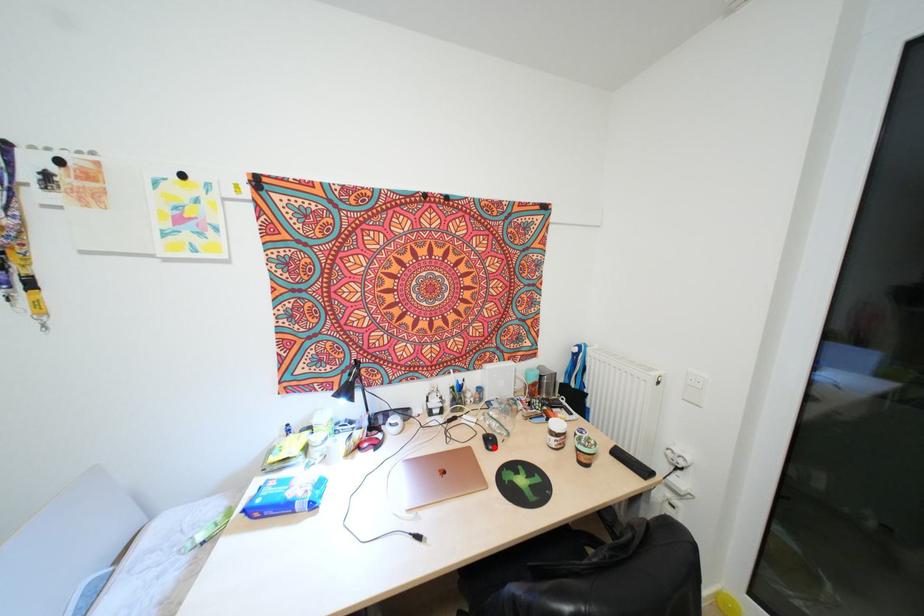
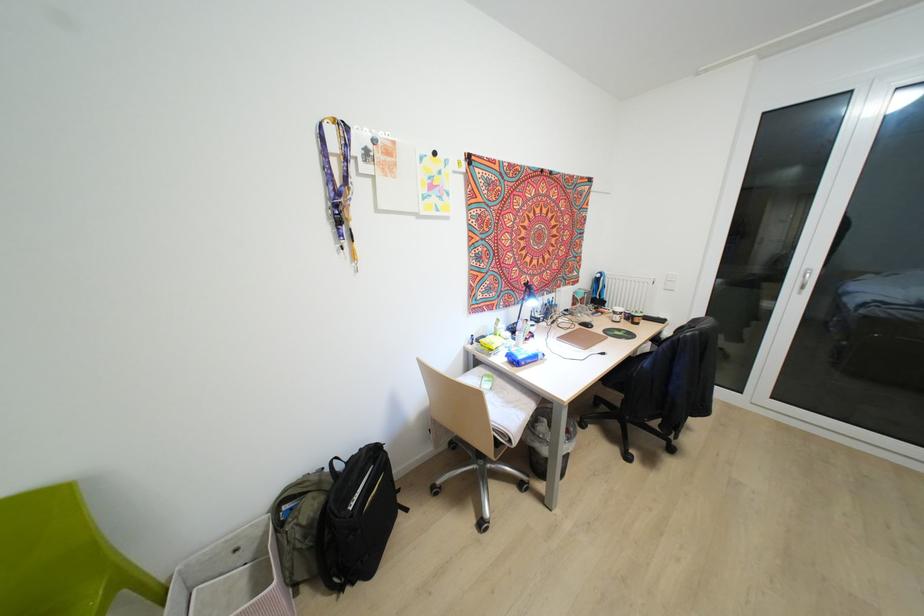
Locate, in the second image, the point that corresponds to the highlighted location in the first image.

(591, 326)